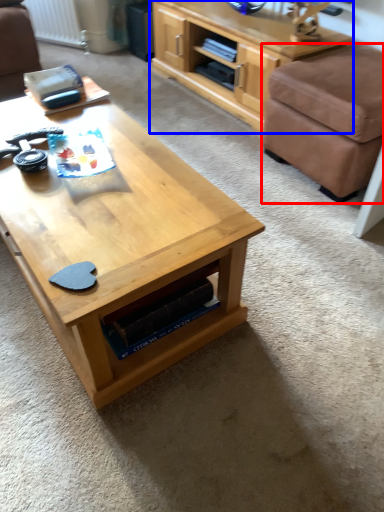
Question: Which point is closer to the camera, stool (highlighted by a red box) or shelf (highlighted by a blue box)?

Choices:
 (A) stool
 (B) shelf

Answer: (A)